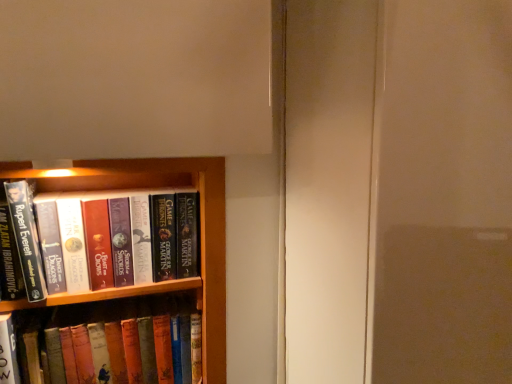
Question: From a real-world perspective, is hardcover book at left, marked as the 1th book in a bottom-to-top arrangement, positioned under hardcover books at left, positioned as the 2th book in bottom-to-top order, based on gravity?

Choices:
 (A) yes
 (B) no

Answer: (A)

Question: Is hardcover book at left, marked as the 1th book in a bottom-to-top arrangement, bigger than hardcover books at left, the first book when ordered from top to bottom?

Choices:
 (A) yes
 (B) no

Answer: (A)

Question: Is hardcover book at left, which is counted as the second book, starting from the top, positioned with its back to hardcover books at left, positioned as the 2th book in bottom-to-top order?

Choices:
 (A) yes
 (B) no

Answer: (B)

Question: Can you confirm if hardcover book at left, which is counted as the second book, starting from the top, is taller than hardcover books at left, the first book when ordered from top to bottom?

Choices:
 (A) yes
 (B) no

Answer: (A)

Question: Is there a large distance between hardcover book at left, marked as the 1th book in a bottom-to-top arrangement, and hardcover books at left, positioned as the 2th book in bottom-to-top order?

Choices:
 (A) yes
 (B) no

Answer: (B)

Question: Considering the relative positions of hardcover book at left, which is counted as the second book, starting from the top, and hardcover books at left, the first book when ordered from top to bottom, in the image provided, is hardcover book at left, which is counted as the second book, starting from the top, to the left of hardcover books at left, the first book when ordered from top to bottom, from the viewer's perspective?

Choices:
 (A) no
 (B) yes

Answer: (B)

Question: Considering the relative sizes of hardcover books at left, positioned as the 2th book in bottom-to-top order, and hardcover book at left, marked as the 1th book in a bottom-to-top arrangement, in the image provided, is hardcover books at left, positioned as the 2th book in bottom-to-top order, smaller than hardcover book at left, marked as the 1th book in a bottom-to-top arrangement,?

Choices:
 (A) no
 (B) yes

Answer: (B)

Question: Can you confirm if hardcover books at left, positioned as the 2th book in bottom-to-top order, is positioned to the right of hardcover book at left, which is counted as the second book, starting from the top?

Choices:
 (A) no
 (B) yes

Answer: (B)

Question: Is hardcover books at left, the first book when ordered from top to bottom, bigger than hardcover book at left, marked as the 1th book in a bottom-to-top arrangement?

Choices:
 (A) no
 (B) yes

Answer: (A)

Question: Is the depth of hardcover books at left, positioned as the 2th book in bottom-to-top order, greater than that of hardcover book at left, which is counted as the second book, starting from the top?

Choices:
 (A) no
 (B) yes

Answer: (A)

Question: Does hardcover books at left, positioned as the 2th book in bottom-to-top order, have a greater width compared to hardcover book at left, marked as the 1th book in a bottom-to-top arrangement?

Choices:
 (A) no
 (B) yes

Answer: (B)

Question: From the image's perspective, would you say hardcover books at left, the first book when ordered from top to bottom, is shown under hardcover book at left, marked as the 1th book in a bottom-to-top arrangement?

Choices:
 (A) yes
 (B) no

Answer: (B)

Question: From the image's perspective, relative to hardcover book at left, marked as the 1th book in a bottom-to-top arrangement, is hardcover books at left, the first book when ordered from top to bottom, above or below?

Choices:
 (A) below
 (B) above

Answer: (B)